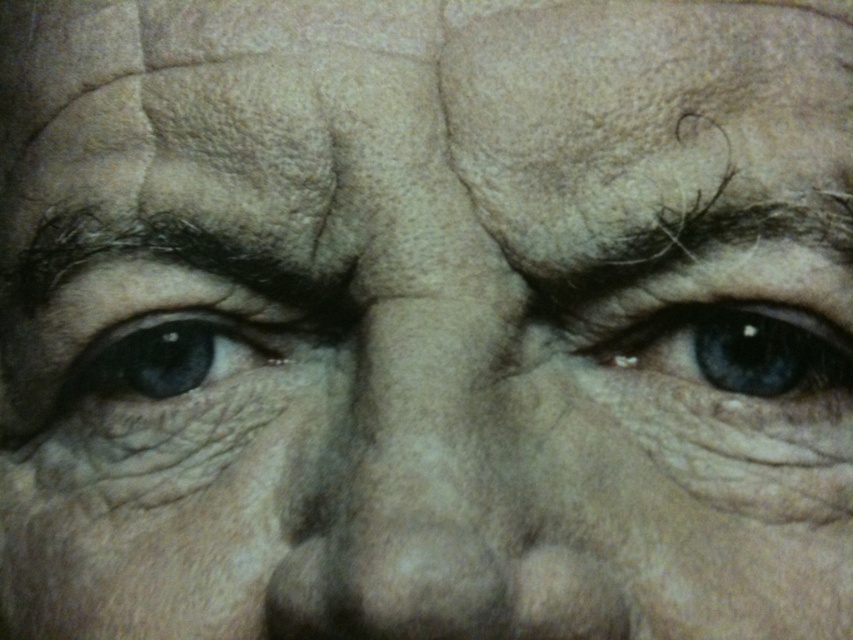
Can you confirm if dry skin at center is shorter than dark brown furrowed eyebrow at upper left?

No, dry skin at center is not shorter than dark brown furrowed eyebrow at upper left.

From the picture: Is dry skin at center to the left of dark brown furrowed eyebrow at upper left from the viewer's perspective?

No, dry skin at center is not to the left of dark brown furrowed eyebrow at upper left.

Who is more distant from viewer, (70, 44) or (177, 221)?

The point (70, 44) is more distant.

At what (x,y) coordinates should I click in order to perform the action: click on dry skin at center. Please return your answer as a coordinate pair (x, y). Looking at the image, I should click on (426, 60).

Who is more forward, (x=463, y=388) or (x=318, y=275)?

Positioned in front is point (x=463, y=388).

Who is lower down, smooth skin nose at center or dark brown furrowed eyebrow at upper left?

smooth skin nose at center is below.

Locate an element on the screen. smooth skin nose at center is located at coordinates (410, 492).

Find the location of a particular element. This screenshot has height=640, width=853. smooth skin nose at center is located at coordinates (410, 492).

Can you confirm if dry skin at center is bigger than smooth skin nose at center?

Yes.

Can you confirm if dry skin at center is smaller than smooth skin nose at center?

Incorrect, dry skin at center is not smaller in size than smooth skin nose at center.

Locate an element on the screen. Image resolution: width=853 pixels, height=640 pixels. dry skin at center is located at coordinates coord(426,60).